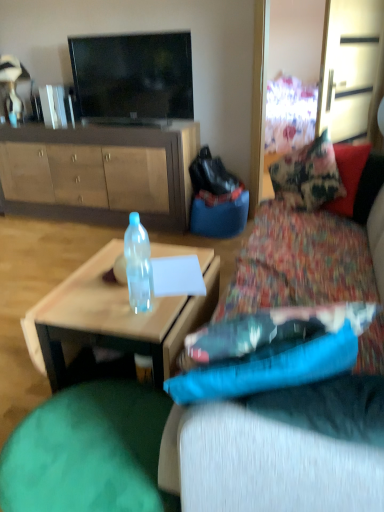
Find the location of a particular element. Image resolution: width=384 pixels, height=512 pixels. free space above translucent plastic coffee table at center (from a real-world perspective) is located at coordinates (121, 287).